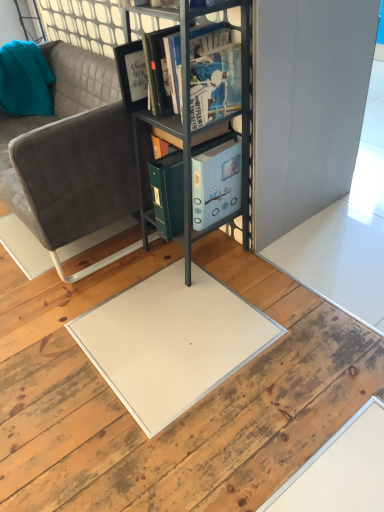
Question: Is matte black book at center positioned beyond the bounds of teal fabric pillow at upper left?

Choices:
 (A) yes
 (B) no

Answer: (A)

Question: Is matte black book at center further to the viewer compared to teal fabric pillow at upper left?

Choices:
 (A) yes
 (B) no

Answer: (B)

Question: Does matte black book at center have a larger size compared to teal fabric pillow at upper left?

Choices:
 (A) no
 (B) yes

Answer: (B)

Question: From a real-world perspective, is matte black book at center on teal fabric pillow at upper left?

Choices:
 (A) yes
 (B) no

Answer: (A)

Question: Could you tell me if matte black book at center is turned towards teal fabric pillow at upper left?

Choices:
 (A) yes
 (B) no

Answer: (B)

Question: Considering the relative positions of matte black book at center and teal fabric pillow at upper left in the image provided, is matte black book at center to the right of teal fabric pillow at upper left from the viewer's perspective?

Choices:
 (A) yes
 (B) no

Answer: (A)

Question: From a real-world perspective, is matte black book at center located beneath gray fabric couch at center?

Choices:
 (A) yes
 (B) no

Answer: (B)

Question: From the image's perspective, is matte black book at center above gray fabric couch at center?

Choices:
 (A) no
 (B) yes

Answer: (B)

Question: From a real-world perspective, does matte black book at center stand above gray fabric couch at center?

Choices:
 (A) no
 (B) yes

Answer: (B)

Question: Is matte black book at center not within gray fabric couch at center?

Choices:
 (A) no
 (B) yes

Answer: (B)

Question: Considering the relative sizes of matte black book at center and gray fabric couch at center in the image provided, is matte black book at center taller than gray fabric couch at center?

Choices:
 (A) yes
 (B) no

Answer: (B)

Question: Is matte black book at center to the left of gray fabric couch at center from the viewer's perspective?

Choices:
 (A) yes
 (B) no

Answer: (B)

Question: Can you confirm if matte black book at center is smaller than metallic gray bookshelf at center?

Choices:
 (A) no
 (B) yes

Answer: (B)